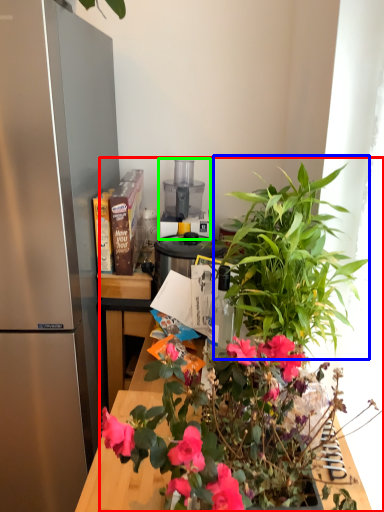
Question: Estimate the real-world distances between objects in this image. Which object is closer to houseplant (highlighted by a red box), vegetation (highlighted by a blue box) or appliance (highlighted by a green box)?

Choices:
 (A) vegetation
 (B) appliance

Answer: (A)